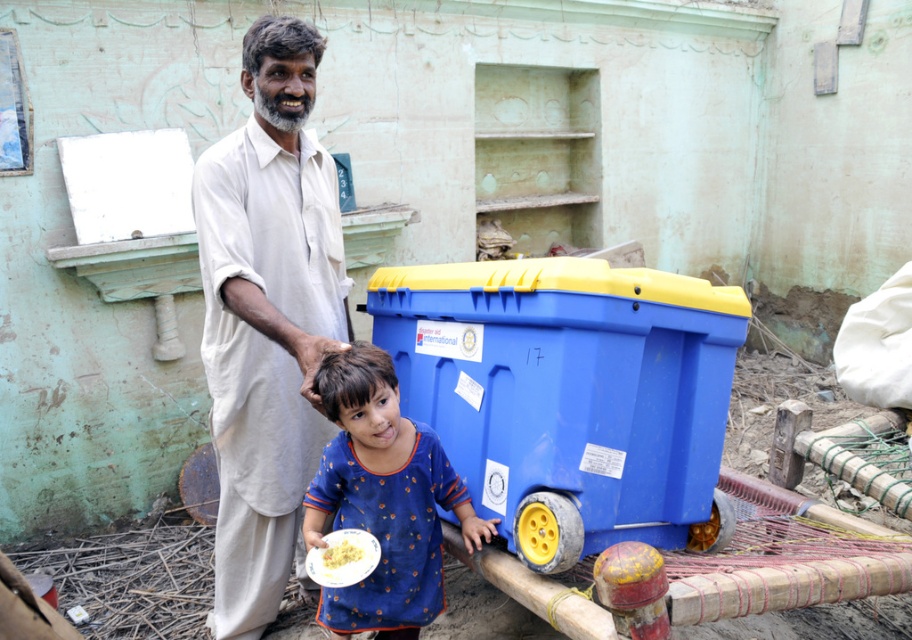
You are a sanitation inspector checking the proper disposal of items. You see the blue plastic recycling bin at lower right and the yellow matte food at lower center. Which item is placed in the correct location according to recycling guidelines?

The blue plastic recycling bin at lower right is positioned over yellow matte food at lower center, which means the food is not placed in the recycling bin. Food waste should be disposed of in a compost or organic waste bin, not in recycling bins. Therefore, neither item is correctly placed since the food is not in the recycling bin and the recycling bin is incorrectly placed over the food.

You are taking a photo of the scene and want to ensure both the adult male and the young child are in focus. The adult male is at point [665,513] and the child is at point [316,36]. Given that your camera has a depth of field that can only sharply focus on one point, which point should you focus on to maximize the likelihood that both are in focus?

You should focus on point [665,513] because it is closer to the camera than point [316,36]. Focusing on the closer point will allow the depth of field to extend further back, potentially keeping both subjects in focus.